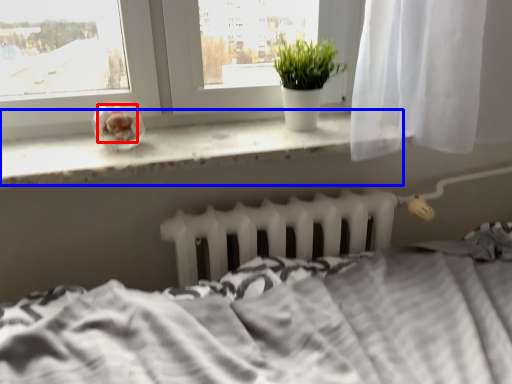
Question: Which object is closer to the camera taking this photo, food (highlighted by a red box) or window sill (highlighted by a blue box)?

Choices:
 (A) food
 (B) window sill

Answer: (B)